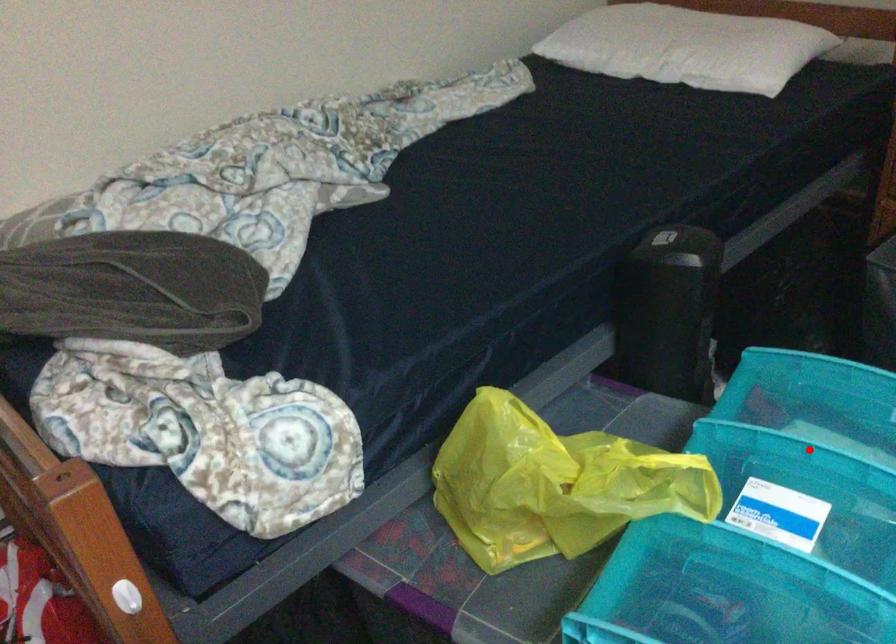
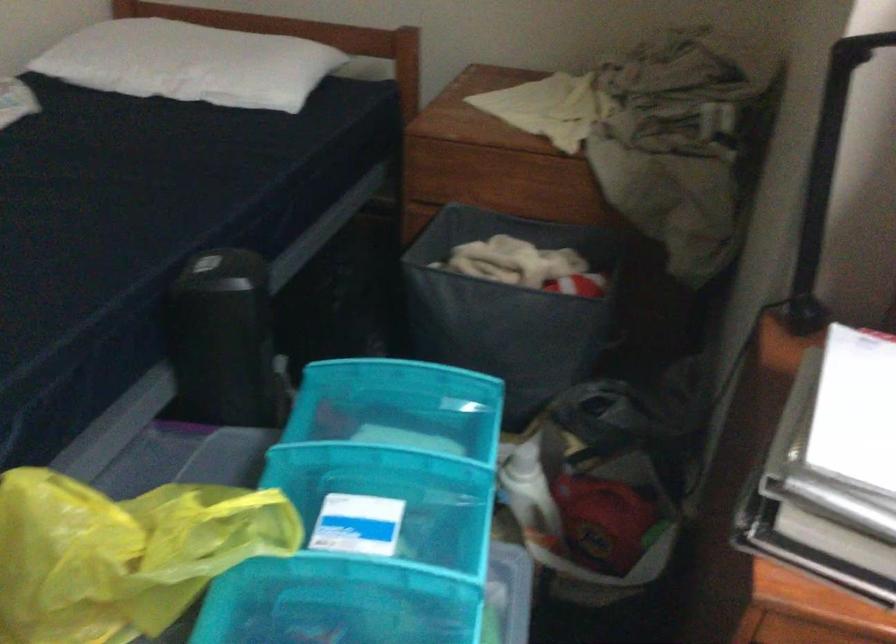
Locate, in the second image, the point that corresponds to the highlighted location in the first image.

(376, 451)